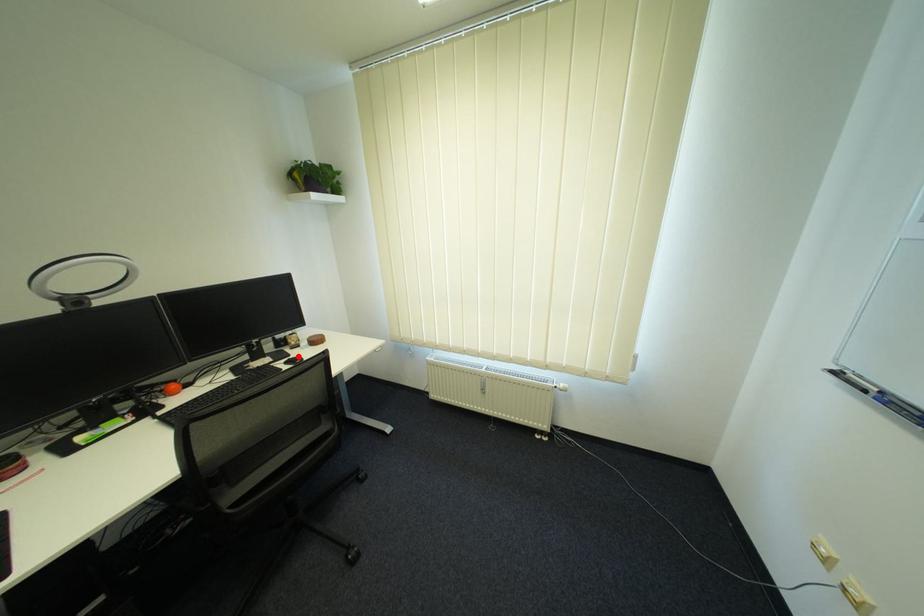
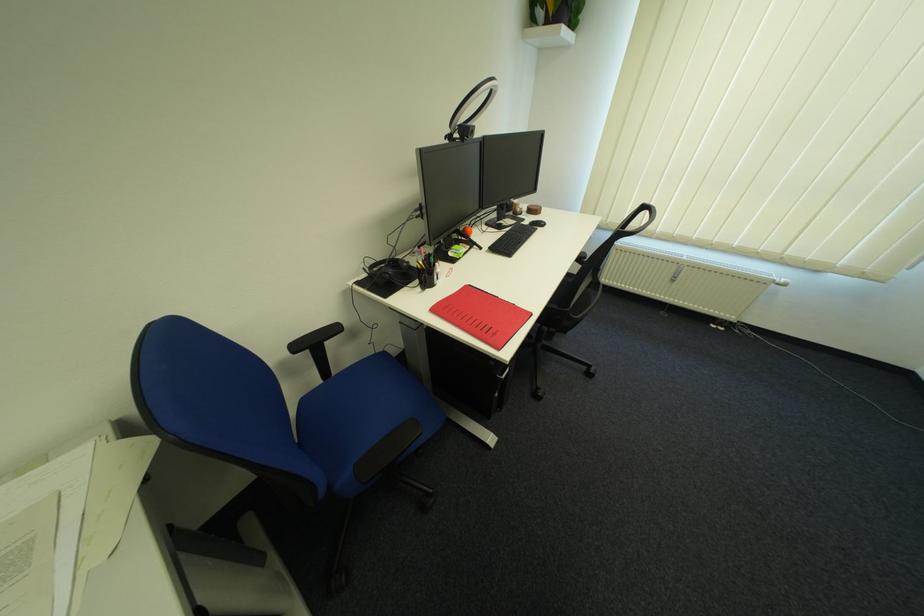
Question: I am providing you with two images of the same scene from different viewpoints. Given a red point in image1, look at the same physical point in image2. Is it:

Choices:
 (A) Closer to the viewpoint
 (B) Farther from the viewpoint

Answer: (A)